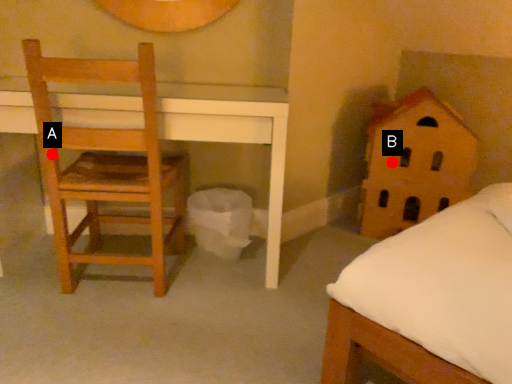
Question: Two points are circled on the image, labeled by A and B beside each circle. Which point is closer to the camera?

Choices:
 (A) A is closer
 (B) B is closer

Answer: (A)